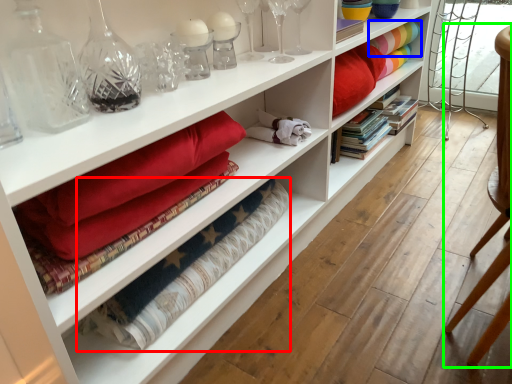
Question: Which is nearer to the material (highlighted by a red box)? fabric (highlighted by a blue box) or armchair (highlighted by a green box).

Choices:
 (A) fabric
 (B) armchair

Answer: (B)